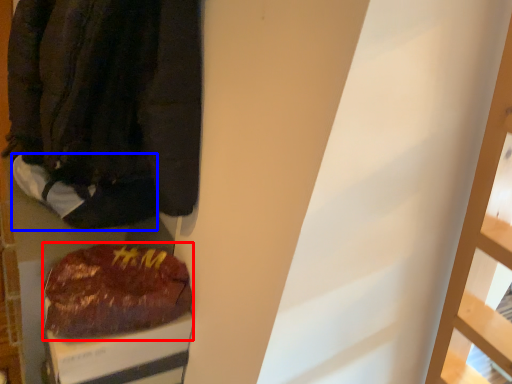
Question: Which point is further to the camera, food (highlighted by a red box) or footwear (highlighted by a blue box)?

Choices:
 (A) food
 (B) footwear

Answer: (B)